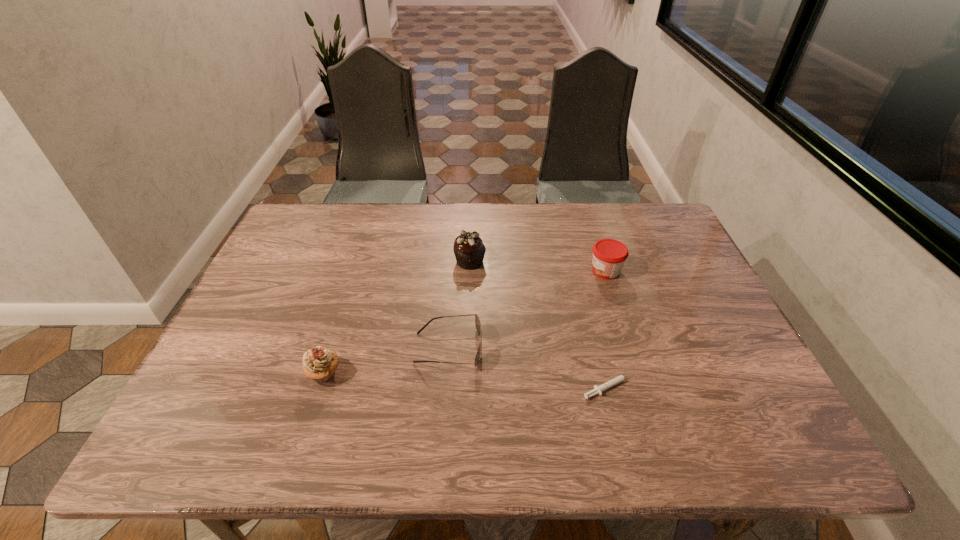
This screenshot has height=540, width=960. In order to click on vacant area situated 0.290m on the label side of the third shortest object in this screenshot , I will do `click(488, 270)`.

The image size is (960, 540). What are the coordinates of `vacant point located on the front-facing side of the sunglasses` in the screenshot? It's located at (599, 348).

I want to click on free space located 0.310m on the back of the syringe, so click(x=583, y=281).

Locate an element on the screen. vacant space at the far edge of the desktop is located at coordinates (564, 215).

The width and height of the screenshot is (960, 540). Identify the location of vacant region at the near edge of the desktop. (461, 456).

I want to click on vacant space at the left edge, so click(x=272, y=260).

Find the location of a particular element. This screenshot has height=540, width=960. free space at the far left corner of the desktop is located at coordinates (311, 216).

Where is `vacant area that lies between the right cupcake and the syringe`? This screenshot has width=960, height=540. vacant area that lies between the right cupcake and the syringe is located at coordinates (540, 324).

Locate an element on the screen. This screenshot has width=960, height=540. vacant space that is in between the jam and the sunglasses is located at coordinates (527, 309).

Image resolution: width=960 pixels, height=540 pixels. Identify the location of unoccupied position between the fourth tallest object and the shortest object. (529, 367).